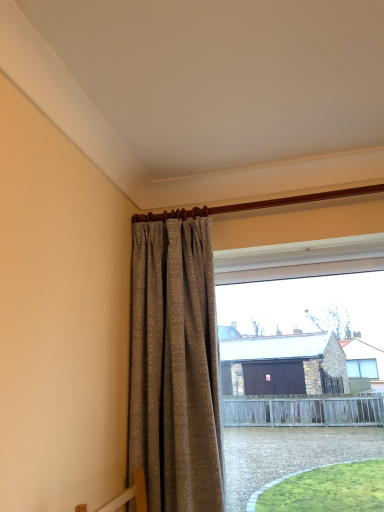
Question: Should I look upward or downward to see beige textured curtain at center?

Choices:
 (A) up
 (B) down

Answer: (B)

Question: From a real-world perspective, is transparent glass window at center on top of beige textured curtain at center?

Choices:
 (A) yes
 (B) no

Answer: (B)

Question: Is transparent glass window at center placed right next to beige textured curtain at center?

Choices:
 (A) no
 (B) yes

Answer: (A)

Question: Is transparent glass window at center looking in the opposite direction of beige textured curtain at center?

Choices:
 (A) no
 (B) yes

Answer: (A)

Question: From a real-world perspective, does transparent glass window at center sit lower than beige textured curtain at center?

Choices:
 (A) yes
 (B) no

Answer: (A)

Question: Does transparent glass window at center have a lesser height compared to beige textured curtain at center?

Choices:
 (A) yes
 (B) no

Answer: (A)

Question: Would you consider transparent glass window at center to be distant from beige textured curtain at center?

Choices:
 (A) yes
 (B) no

Answer: (B)

Question: Can we say beige textured curtain at center lies outside transparent glass window at center?

Choices:
 (A) yes
 (B) no

Answer: (A)

Question: From a real-world perspective, does beige textured curtain at center sit lower than transparent glass window at center?

Choices:
 (A) no
 (B) yes

Answer: (A)

Question: Is beige textured curtain at center thinner than transparent glass window at center?

Choices:
 (A) yes
 (B) no

Answer: (B)

Question: Is beige textured curtain at center turned away from transparent glass window at center?

Choices:
 (A) yes
 (B) no

Answer: (B)

Question: Can you confirm if beige textured curtain at center is bigger than transparent glass window at center?

Choices:
 (A) yes
 (B) no

Answer: (B)

Question: Considering the relative positions of beige textured curtain at center and transparent glass window at center in the image provided, is beige textured curtain at center behind transparent glass window at center?

Choices:
 (A) yes
 (B) no

Answer: (B)

Question: Considering their positions, is transparent glass window at center located in front of or behind beige textured curtain at center?

Choices:
 (A) behind
 (B) front

Answer: (A)